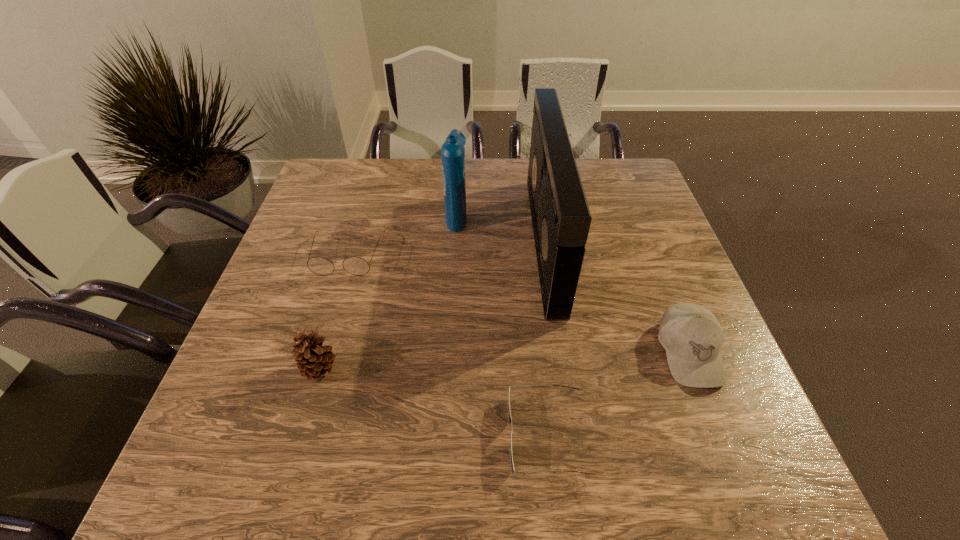
Where is `videotape`? videotape is located at coordinates (561, 219).

At what (x,y) coordinates should I click in order to perform the action: click on the third object from left to right. Please return your answer as a coordinate pair (x, y). The height and width of the screenshot is (540, 960). Looking at the image, I should click on (452, 151).

You are a GUI agent. You are given a task and a screenshot of the screen. Output one action in this format:
    pyautogui.click(x=<x>, y=<y>)
    Task: Click on the pinecone
    This screenshot has height=540, width=960.
    Given the screenshot: What is the action you would take?
    pyautogui.click(x=314, y=360)

Where is `the fourth tallest object`? The width and height of the screenshot is (960, 540). the fourth tallest object is located at coordinates (691, 335).

Identify the location of baseball cap. This screenshot has width=960, height=540. pos(691,335).

Locate an element on the screen. The width and height of the screenshot is (960, 540). spectacles is located at coordinates (357, 266).

Where is `sunglasses`? This screenshot has height=540, width=960. sunglasses is located at coordinates (509, 414).

This screenshot has width=960, height=540. I want to click on the shortest object, so click(x=509, y=414).

I want to click on vacant space located 0.070m on the front side of the videotape, so click(x=508, y=242).

You are a GUI agent. You are given a task and a screenshot of the screen. Output one action in this format:
    pyautogui.click(x=<x>, y=<y>)
    Task: Click on the free location located on the front side of the videotape
    Image resolution: width=960 pixels, height=540 pixels.
    Given the screenshot: What is the action you would take?
    pyautogui.click(x=489, y=242)